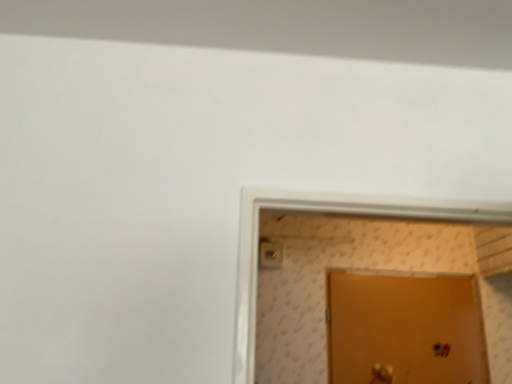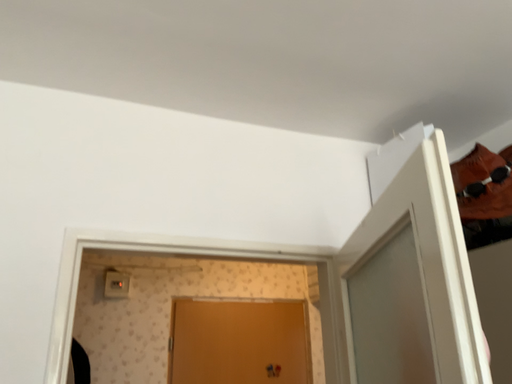
Question: How did the camera likely rotate when shooting the video?

Choices:
 (A) rotated right
 (B) rotated left

Answer: (A)